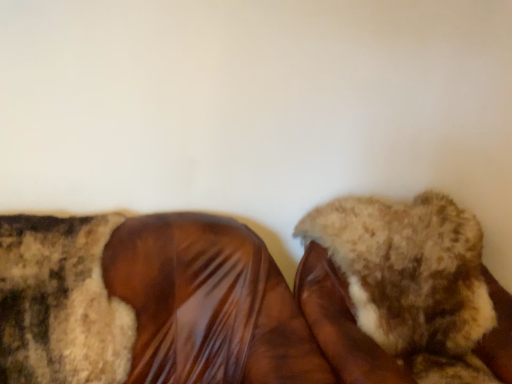
Question: Is shiny brown shoe at center, positioned as the 2th footwear in right-to-left order, to the left or to the right of fuzzy fabric shoe at center, which is the 1th footwear in right-to-left order, in the image?

Choices:
 (A) right
 (B) left

Answer: (B)

Question: Do you think shiny brown shoe at center, positioned as the 2th footwear in right-to-left order, is within fuzzy fabric shoe at center, which is the 1th footwear in right-to-left order, or outside of it?

Choices:
 (A) inside
 (B) outside

Answer: (B)

Question: From the image's perspective, relative to fuzzy fabric shoe at center, positioned as the second footwear in left-to-right order, is shiny brown shoe at center, positioned as the 2th footwear in right-to-left order, above or below?

Choices:
 (A) below
 (B) above

Answer: (A)

Question: From a real-world perspective, is fuzzy fabric shoe at center, which is the 1th footwear in right-to-left order, positioned above or below shiny brown shoe at center, positioned as the 2th footwear in right-to-left order?

Choices:
 (A) above
 (B) below

Answer: (A)

Question: Is fuzzy fabric shoe at center, positioned as the second footwear in left-to-right order, inside or outside of shiny brown shoe at center, positioned as the 2th footwear in right-to-left order?

Choices:
 (A) inside
 (B) outside

Answer: (B)

Question: Is fuzzy fabric shoe at center, positioned as the second footwear in left-to-right order, bigger or smaller than shiny brown shoe at center, positioned as the 2th footwear in right-to-left order?

Choices:
 (A) big
 (B) small

Answer: (B)

Question: From the image's perspective, is fuzzy fabric shoe at center, positioned as the second footwear in left-to-right order, positioned above or below shiny brown shoe at center, which is counted as the first footwear, starting from the left?

Choices:
 (A) below
 (B) above

Answer: (B)